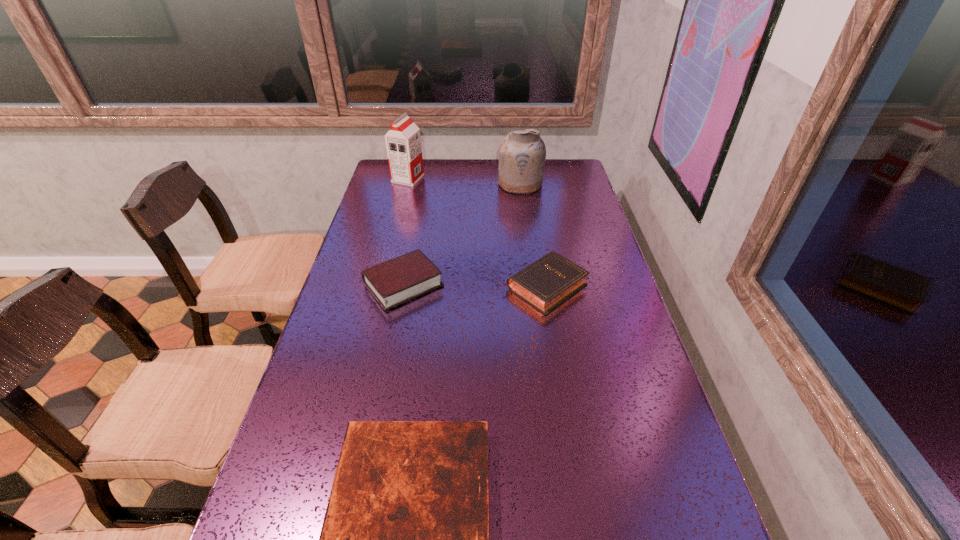
Identify the location of object that is at the right edge. (545, 284).

Where is `object present at the far left corner`? Image resolution: width=960 pixels, height=540 pixels. object present at the far left corner is located at coordinates (403, 141).

The height and width of the screenshot is (540, 960). In the image, there is a desktop. What are the coordinates of `vacant space at the left edge` in the screenshot? It's located at (353, 342).

The height and width of the screenshot is (540, 960). I want to click on free space at the right edge of the desktop, so click(582, 253).

Locate an element on the screen. vacant space at the far right corner is located at coordinates (576, 186).

Identify the location of vacant area that lies between the soya milk and the rightmost Bible. This screenshot has height=540, width=960. (476, 233).

Image resolution: width=960 pixels, height=540 pixels. I want to click on vacant space in between the soya milk and the pottery, so click(465, 181).

At what (x,y) coordinates should I click in order to perform the action: click on free spot between the rightmost Bible and the pottery. Please return your answer as a coordinate pair (x, y). The height and width of the screenshot is (540, 960). Looking at the image, I should click on (533, 235).

This screenshot has height=540, width=960. In order to click on free spot between the soya milk and the rightmost Bible in this screenshot , I will do click(x=476, y=233).

Select which object is the fourth closest to the soya milk. Please provide its 2D coordinates. Your answer should be formatted as a tuple, i.e. [(x, y)], where the tuple contains the x and y coordinates of a point satisfying the conditions above.

[(405, 539)]